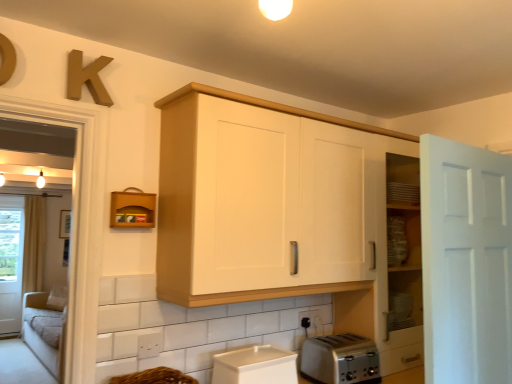
Locate an element on the screen. This screenshot has width=512, height=384. white matte door at right is located at coordinates (466, 262).

At what (x,y) coordinates should I click in order to perform the action: click on wooden letter k at upper left. Please return your answer as a coordinate pair (x, y). The image size is (512, 384). Looking at the image, I should click on [87, 78].

Image resolution: width=512 pixels, height=384 pixels. Describe the element at coordinates (87, 78) in the screenshot. I see `wooden letter k at upper left` at that location.

What is the approximate width of white plastic container at lower center?

white plastic container at lower center is 9.07 inches wide.

Where is `white plastic container at lower center`? The height and width of the screenshot is (384, 512). white plastic container at lower center is located at coordinates (255, 366).

The height and width of the screenshot is (384, 512). What do you see at coordinates (273, 199) in the screenshot? I see `white wood cabinet at upper center` at bounding box center [273, 199].

Where is `brown woven basket at lower center`? This screenshot has width=512, height=384. brown woven basket at lower center is located at coordinates (154, 377).

This screenshot has height=384, width=512. I want to click on white matte door at right, so click(466, 262).

From a real-world perspective, is brown leather shelf at upper left physically located above or below black plastic electric outlet at lower center?

brown leather shelf at upper left is above black plastic electric outlet at lower center.

In the scene shown: From the image's perspective, is brown leather shelf at upper left beneath black plastic electric outlet at lower center?

No, from the image's perspective, brown leather shelf at upper left is not below black plastic electric outlet at lower center.

Is brown leather shelf at upper left thinner than black plastic electric outlet at lower center?

No, brown leather shelf at upper left is not thinner than black plastic electric outlet at lower center.

Considering the sizes of brown leather shelf at upper left and black plastic electric outlet at lower center in the image, is brown leather shelf at upper left taller or shorter than black plastic electric outlet at lower center?

Clearly, brown leather shelf at upper left is taller compared to black plastic electric outlet at lower center.

Which object is further away from the camera taking this photo, satin silver toaster at lower center or beige fabric screen door at left?

beige fabric screen door at left is behind.

Find the location of `toaster above the beige fabric screen door at left (from the image's perspective)`. toaster above the beige fabric screen door at left (from the image's perspective) is located at coordinates (340, 359).

From the picture: Are satin silver toaster at lower center and beige fabric screen door at left far apart?

satin silver toaster at lower center is positioned a significant distance from beige fabric screen door at left.

What's the angular difference between satin silver toaster at lower center and beige fabric screen door at left's facing directions?

The facing directions of satin silver toaster at lower center and beige fabric screen door at left are 2.36 degrees apart.

Can you confirm if beige fabric screen door at left is positioned to the right of brown leather shelf at upper left?

No.

Is beige fabric screen door at left directly adjacent to brown leather shelf at upper left?

beige fabric screen door at left and brown leather shelf at upper left are not in contact.

In terms of height, does beige fabric screen door at left look taller or shorter compared to brown leather shelf at upper left?

Considering their sizes, beige fabric screen door at left has more height than brown leather shelf at upper left.

Looking at this image, from a real-world perspective, is brown woven basket at lower center beneath white wood cabinet at upper center?

Indeed, from a real-world perspective, brown woven basket at lower center is positioned beneath white wood cabinet at upper center.

Does brown woven basket at lower center lie behind white wood cabinet at upper center?

No, brown woven basket at lower center is in front of white wood cabinet at upper center.

Is brown woven basket at lower center wider or thinner than white wood cabinet at upper center?

Clearly, brown woven basket at lower center has less width compared to white wood cabinet at upper center.

Between brown woven basket at lower center and white wood cabinet at upper center, which one has larger size?

white wood cabinet at upper center is bigger.

Based on the photo, is white plastic container at lower center turned away from brown woven basket at lower center?

No.

Is point (263, 355) behind point (149, 375)?

Yes, point (263, 355) is farther from viewer.

Is the surface of white plastic container at lower center in direct contact with brown woven basket at lower center?

There is a gap between white plastic container at lower center and brown woven basket at lower center.

Does white plastic container at lower center have a larger size compared to brown woven basket at lower center?

Yes, white plastic container at lower center is bigger than brown woven basket at lower center.

Looking at this image, is white wood cabinet at upper center positioned far away from brown leather shelf at upper left?

No, white wood cabinet at upper center is not far away from brown leather shelf at upper left.

Is white wood cabinet at upper center turned away from brown leather shelf at upper left?

No, brown leather shelf at upper left is not at the back of white wood cabinet at upper center.

From the image's perspective, is white wood cabinet at upper center above or below brown leather shelf at upper left?

From the image's perspective, white wood cabinet at upper center appears above brown leather shelf at upper left.

Is white wood cabinet at upper center at the left side of brown leather shelf at upper left?

In fact, white wood cabinet at upper center is to the right of brown leather shelf at upper left.

Does brown leather shelf at upper left have a smaller size compared to white wood cabinet at upper center?

Indeed, brown leather shelf at upper left has a smaller size compared to white wood cabinet at upper center.

Is brown leather shelf at upper left outside of white wood cabinet at upper center?

Absolutely, brown leather shelf at upper left is external to white wood cabinet at upper center.

The image size is (512, 384). Find the location of `cabinetry above the brown leather shelf at upper left (from the image's perspective)`. cabinetry above the brown leather shelf at upper left (from the image's perspective) is located at coordinates (273, 199).

Where is `electric outlet that appears on the right of brown leather shelf at upper left`? Image resolution: width=512 pixels, height=384 pixels. electric outlet that appears on the right of brown leather shelf at upper left is located at coordinates [311, 322].

Identify the location of screen door that is on the left side of satin silver toaster at lower center. (11, 263).

Based on their spatial positions, is brown woven basket at lower center or white plastic container at lower center further from black plastic electric outlet at lower center?

Based on the image, brown woven basket at lower center appears to be further to black plastic electric outlet at lower center.

Looking at the image, which one is located further to wooden letter k at upper left, satin silver toaster at lower center or white matte door at right?

white matte door at right is further to wooden letter k at upper left.

Considering their positions, is satin silver toaster at lower center positioned further to beige fabric screen door at left than white matte door at right?

white matte door at right.

Which object lies nearer to the anchor point wooden letter k at upper left, white matte door at right or brown woven basket at lower center?

brown woven basket at lower center.

Based on their spatial positions, is wooden letter k at upper left or white wood cabinet at upper center further from white matte door at right?

wooden letter k at upper left is further to white matte door at right.

Considering their positions, is brown woven basket at lower center positioned further to brown leather shelf at upper left than black plastic electric outlet at lower center?

black plastic electric outlet at lower center is positioned further to the anchor brown leather shelf at upper left.

Considering their positions, is brown leather shelf at upper left positioned further to black plastic electric outlet at lower center than white wood cabinet at upper center?

Based on the image, brown leather shelf at upper left appears to be further to black plastic electric outlet at lower center.

Based on their spatial positions, is beige fabric screen door at left or satin silver toaster at lower center further from white wood cabinet at upper center?

beige fabric screen door at left is further to white wood cabinet at upper center.

This screenshot has height=384, width=512. In order to click on electric outlet between wooden letter k at upper left and white matte door at right in this screenshot , I will do `click(311, 322)`.

At what (x,y) coordinates should I click in order to perform the action: click on shelf located between brown woven basket at lower center and black plastic electric outlet at lower center in the depth direction. Please return your answer as a coordinate pair (x, y). The width and height of the screenshot is (512, 384). Looking at the image, I should click on (132, 209).

The height and width of the screenshot is (384, 512). Identify the location of electric outlet between white plastic container at lower center and beige fabric screen door at left from front to back. (311, 322).

Image resolution: width=512 pixels, height=384 pixels. What are the coordinates of `cabinetry between wooden letter k at upper left and white matte door at right` in the screenshot? It's located at (273, 199).